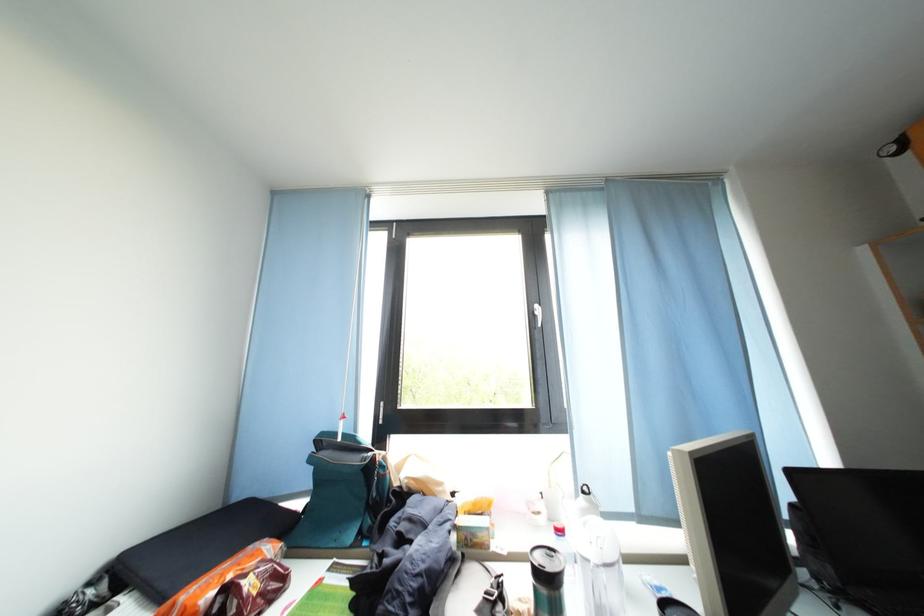
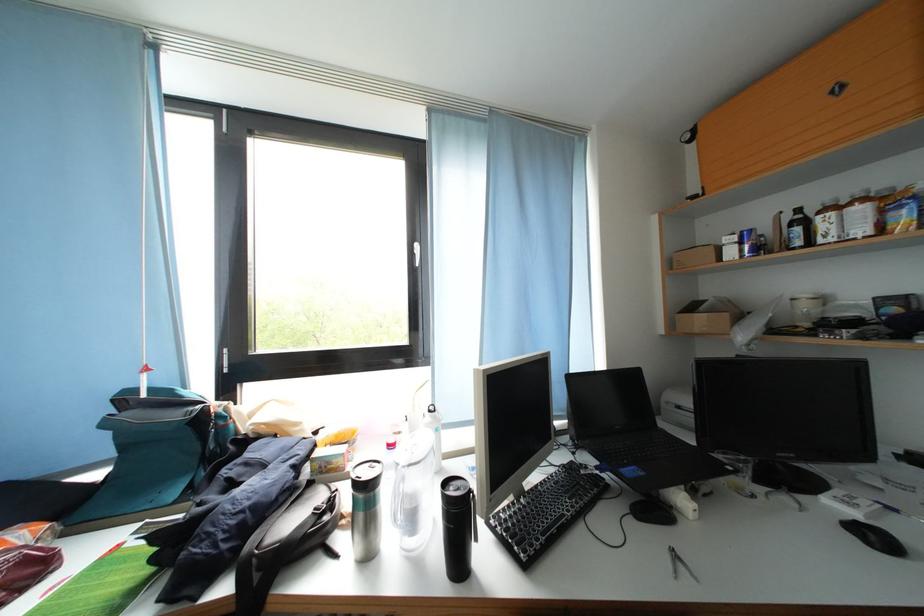
Question: How did the camera likely rotate?

Choices:
 (A) Left
 (B) Right
 (C) Up
 (D) Down

Answer: (B)